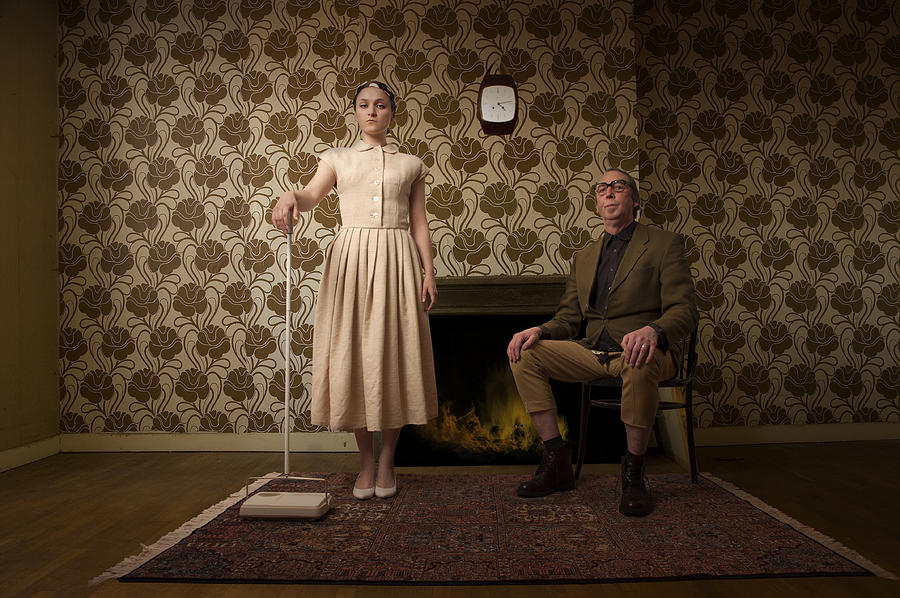
Locate an element on the screen. The width and height of the screenshot is (900, 598). brown wooden chair is located at coordinates (589, 399).